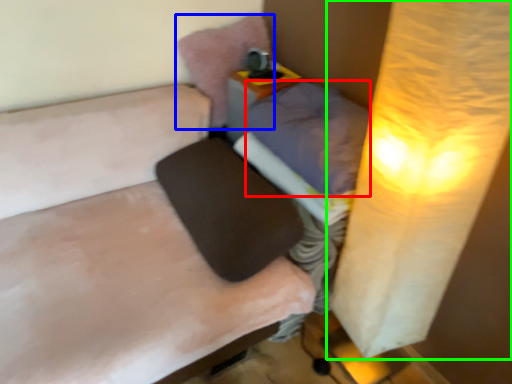
Question: Which object is the farthest from pillow (highlighted by a red box)? Choose among these: pillow (highlighted by a blue box) or lamp (highlighted by a green box).

Choices:
 (A) pillow
 (B) lamp

Answer: (A)